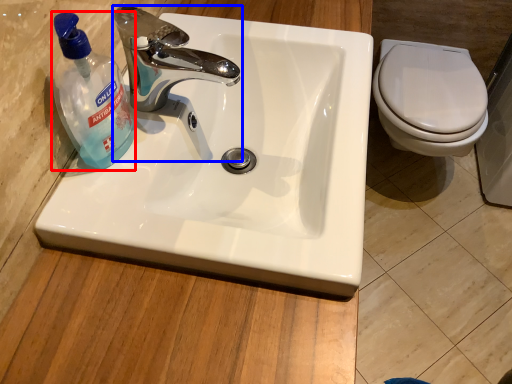
Question: Which object appears closest to the camera in this image, cleaning product (highlighted by a red box) or tap (highlighted by a blue box)?

Choices:
 (A) cleaning product
 (B) tap

Answer: (A)